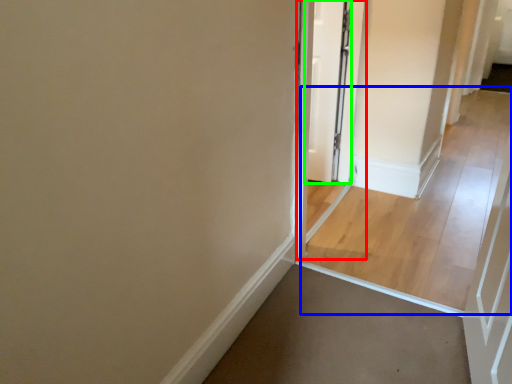
Question: Which object is the closest to the screen door (highlighted by a red box)? Choose among these: path (highlighted by a blue box) or door (highlighted by a green box).

Choices:
 (A) path
 (B) door

Answer: (B)